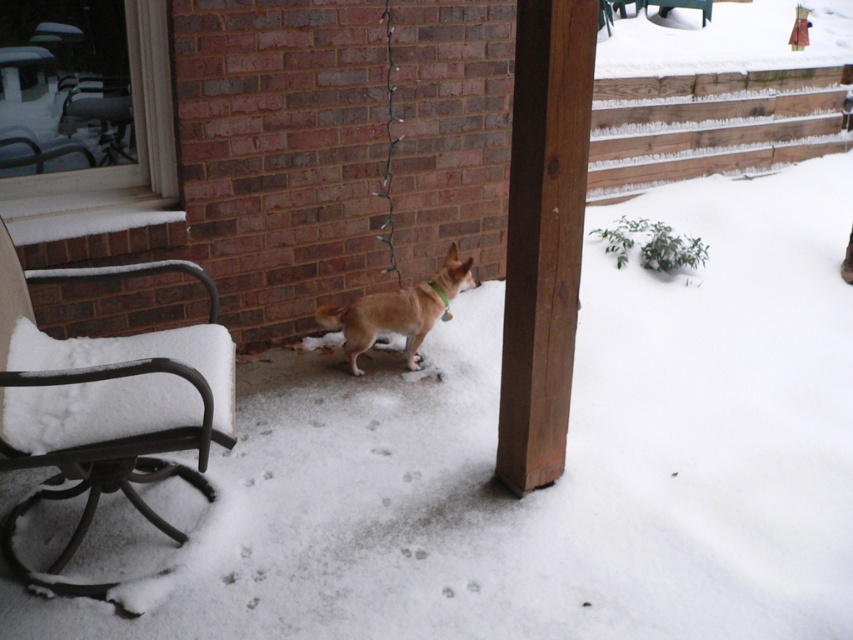
You are standing at the origin point of the image. Which of the two points, point (71, 273) or point (396, 294), is closer to you?

Point (71, 273) is closer to you because it is in front of point (396, 294).

You are a delivery person trying to reach the brown furry dog at center to drop off a package. The metallic black chair at left is blocking your path. Can you walk around the chair to reach the dog without stepping on the snow? Explain your reasoning.

The metallic black chair at left is 38.44 inches from the brown furry dog at center. Since the chair is only 38.44 inches away from the dog, you can easily walk around it to reach the dog without stepping on the snow.

You are a photographer trying to capture a photo of the brown furry dog at center. To avoid including the metallic black chair at left in the shot, should you move closer to or further away from the dog?

You should move closer to the brown furry dog at center. Since the metallic black chair at left is positioned under the dog, moving closer will reduce the field of view, making it less likely to include the chair in the frame.